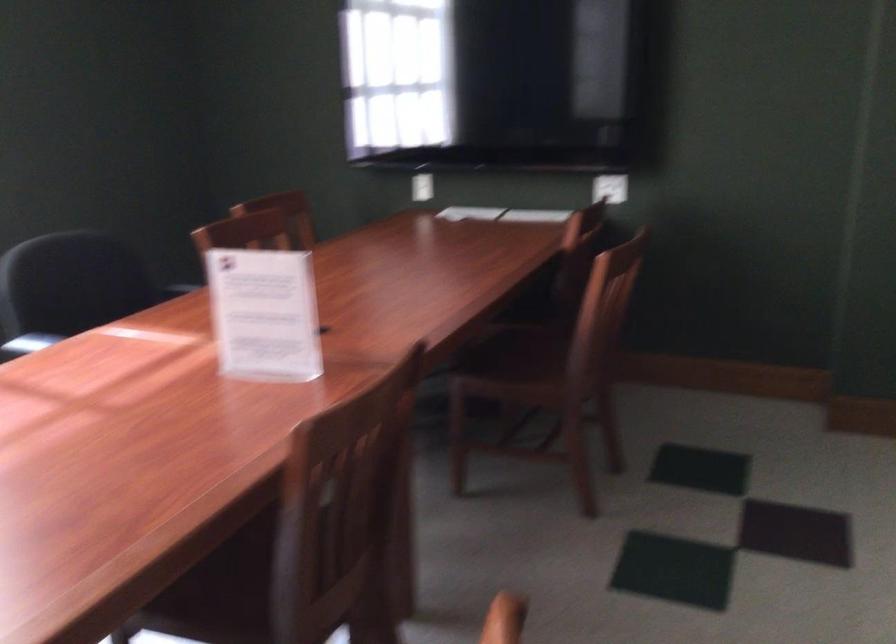
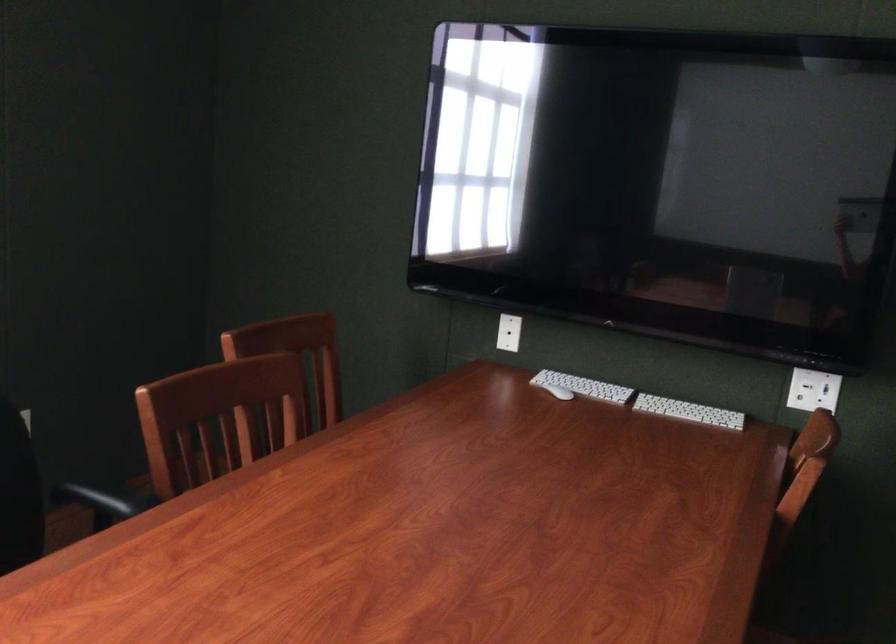
The point at (536, 213) is marked in the first image. Where is the corresponding point in the second image?

(688, 412)